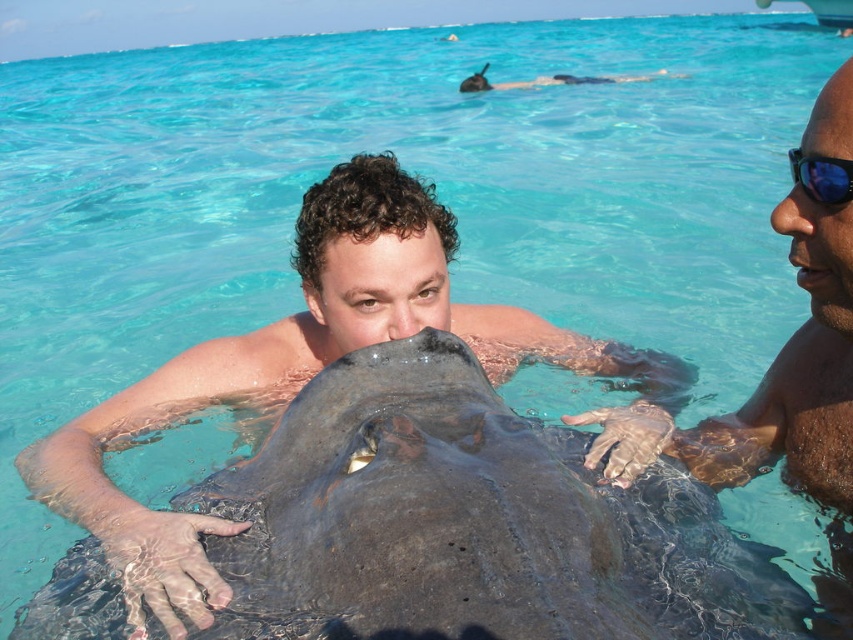
You are a photographer standing at the edge of the water. You want to take a photo of the smooth skin man at right and the stingray. The camera you are using has a maximum focus range of 5 feet. Can you capture both subjects clearly in one shot?

The smooth skin man at right is 4.83 feet away from the viewer. Since the camera can focus up to 5 feet, both subjects are within the focus range and can be captured clearly in one shot.

You are a marine biologist observing the smooth gray stingray at center from a boat anchored 10 feet away. Can you safely approach the stingray within 4 feet without disturbing it? Please explain your reasoning based on the distance provided.

The smooth gray stingray at center is 3.82 feet away from the camera. Since the boat is anchored 10 feet away from the stingray, you would need to cover the 10 feet distance to reach it. However, approaching within 4 feet might be too close and could disturb the stingray. It is recommended to maintain a safe distance of at least 4 feet to avoid stressing the animal.

You are a marine biologist observing the scene. You notice two stingrays in the water. Which stingray is positioned lower in the water between the smooth gray stingray at center and the black matte stingray at upper center?

The smooth gray stingray at center is positioned lower in the water than the black matte stingray at upper center.